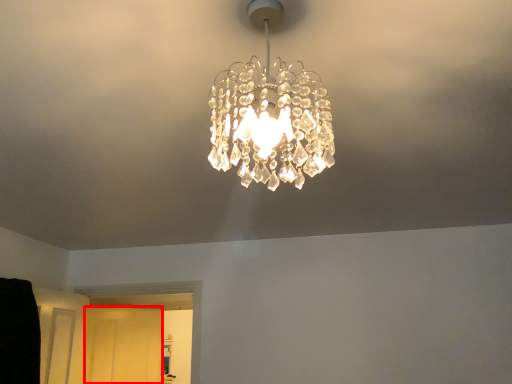
Question: Where is glass door (annotated by the red box) located in relation to lamp in the image?

Choices:
 (A) right
 (B) left

Answer: (B)